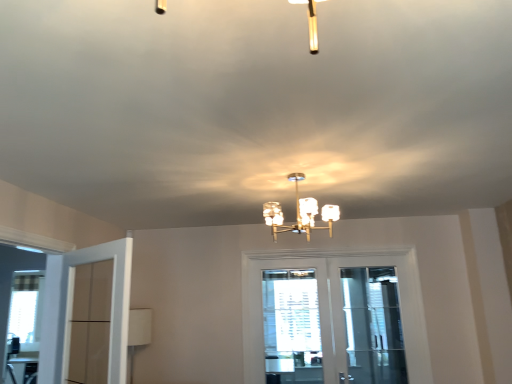
Question: Considering the positions of white matte door at left, the 2th door viewed from the right, and clear glass screen door at center in the image, is white matte door at left, the 2th door viewed from the right, bigger or smaller than clear glass screen door at center?

Choices:
 (A) small
 (B) big

Answer: (B)

Question: Considering the positions of white matte door at left, the 2th door viewed from the right, and clear glass screen door at center in the image, is white matte door at left, the 2th door viewed from the right, wider or thinner than clear glass screen door at center?

Choices:
 (A) wide
 (B) thin

Answer: (A)

Question: Based on their relative distances, which object is nearer to the clear glass screen door at center?

Choices:
 (A) white glossy door at center, the 2th door from the front
 (B) matte glass chandelier at center
 (C) white textured window at center
 (D) white matte door at left, arranged as the 1th door when viewed from the left

Answer: (A)

Question: Considering the real-world distances, which object is farthest from the clear glass screen door at center?

Choices:
 (A) matte glass chandelier at center
 (B) white glossy door at center, the 2th door from the front
 (C) white textured window at center
 (D) white matte door at left, arranged as the 1th door when viewed from the left

Answer: (D)